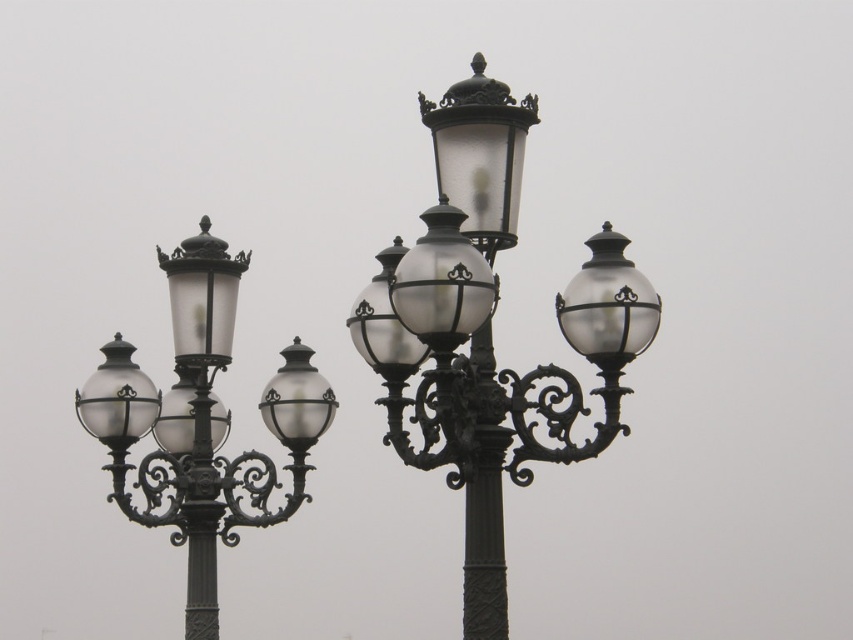
Can you confirm if matte black street light at center is positioned to the left of satin silver globe at center?

No, matte black street light at center is not to the left of satin silver globe at center.

The width and height of the screenshot is (853, 640). What do you see at coordinates (490, 330) in the screenshot? I see `matte black street light at center` at bounding box center [490, 330].

Is point (466, 422) positioned behind point (282, 416)?

That is False.

Identify the location of matte black street light at center. The width and height of the screenshot is (853, 640). 490,330.

Who is positioned more to the right, matte black street light at left or satin silver globe at center?

satin silver globe at center is more to the right.

Between matte black street light at left and satin silver globe at center, which one has less height?

Standing shorter between the two is satin silver globe at center.

Is point (138, 412) farther from camera compared to point (329, 424)?

Yes, point (138, 412) is farther from viewer.

Image resolution: width=853 pixels, height=640 pixels. What are the coordinates of `matte black street light at left` in the screenshot? It's located at (201, 422).

Between point (473, 138) and point (194, 611), which one is positioned behind?

Positioned behind is point (194, 611).

Does matte black street light at center come behind matte black street light at left?

No, it is in front of matte black street light at left.

Where is `matte black street light at center`? matte black street light at center is located at coordinates (490, 330).

The image size is (853, 640). I want to click on matte black street light at center, so click(490, 330).